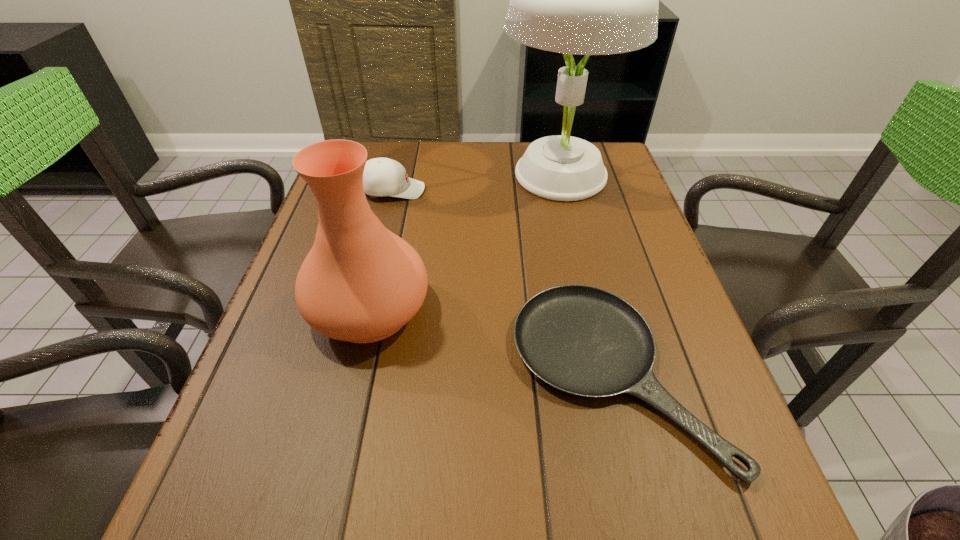
This screenshot has height=540, width=960. Find the location of `the tallest object`. the tallest object is located at coordinates (587, 0).

This screenshot has height=540, width=960. What are the coordinates of `vase` in the screenshot? It's located at (361, 283).

The height and width of the screenshot is (540, 960). I want to click on baseball cap, so pyautogui.click(x=382, y=176).

Identify the location of frying pan. Image resolution: width=960 pixels, height=540 pixels. (582, 340).

Identify the location of free spot located on the front-facing side of the tallest object. The image size is (960, 540). (414, 175).

Where is `vacant region located on the front-facing side of the tallest object`? The height and width of the screenshot is (540, 960). vacant region located on the front-facing side of the tallest object is located at coordinates tap(437, 175).

The width and height of the screenshot is (960, 540). In order to click on free space located 0.140m on the front-facing side of the tallest object in this screenshot , I will do `click(451, 175)`.

Where is `vacant space positioned on the back of the second tallest object`? vacant space positioned on the back of the second tallest object is located at coordinates (397, 191).

Where is `vacant space located on the front-facing side of the third tallest object`? This screenshot has height=540, width=960. vacant space located on the front-facing side of the third tallest object is located at coordinates (542, 190).

In order to click on vacant space situated 0.250m on the back of the shortest object in this screenshot , I will do `click(576, 222)`.